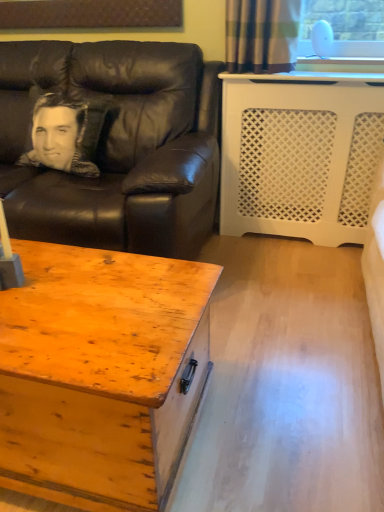
Question: Is silky black pillow at left turned away from black leather couch at left?

Choices:
 (A) yes
 (B) no

Answer: (A)

Question: Can you confirm if silky black pillow at left is bigger than black leather couch at left?

Choices:
 (A) yes
 (B) no

Answer: (B)

Question: From the image's perspective, is silky black pillow at left on black leather couch at left?

Choices:
 (A) yes
 (B) no

Answer: (A)

Question: Is the position of silky black pillow at left more distant than that of black leather couch at left?

Choices:
 (A) yes
 (B) no

Answer: (A)

Question: Is black leather couch at left located within silky black pillow at left?

Choices:
 (A) no
 (B) yes

Answer: (A)

Question: From the image's perspective, is black leather couch at left located above or below wooden chest at lower left?

Choices:
 (A) above
 (B) below

Answer: (A)

Question: Considering the positions of black leather couch at left and wooden chest at lower left in the image, is black leather couch at left bigger or smaller than wooden chest at lower left?

Choices:
 (A) big
 (B) small

Answer: (A)

Question: Considering the relative positions of black leather couch at left and wooden chest at lower left in the image provided, is black leather couch at left to the left or to the right of wooden chest at lower left?

Choices:
 (A) left
 (B) right

Answer: (A)

Question: Is black leather couch at left inside or outside of wooden chest at lower left?

Choices:
 (A) inside
 (B) outside

Answer: (B)

Question: Considering the positions of point (66, 52) and point (48, 163), is point (66, 52) closer or farther from the camera than point (48, 163)?

Choices:
 (A) closer
 (B) farther

Answer: (B)

Question: In terms of height, does black leather couch at left look taller or shorter compared to silky black pillow at left?

Choices:
 (A) short
 (B) tall

Answer: (B)

Question: From a real-world perspective, relative to silky black pillow at left, is black leather couch at left vertically above or below?

Choices:
 (A) above
 (B) below

Answer: (B)

Question: Looking at their shapes, would you say black leather couch at left is wider or thinner than silky black pillow at left?

Choices:
 (A) wide
 (B) thin

Answer: (A)

Question: From the image's perspective, is wooden chest at lower left positioned above or below silky black pillow at left?

Choices:
 (A) above
 (B) below

Answer: (B)

Question: Looking at their shapes, would you say wooden chest at lower left is wider or thinner than silky black pillow at left?

Choices:
 (A) thin
 (B) wide

Answer: (B)